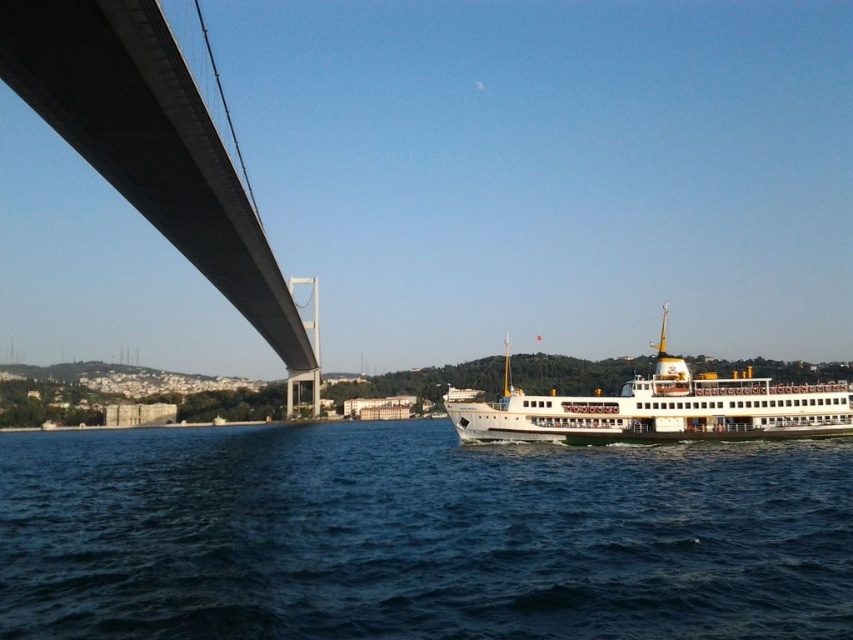
Based on the photo, can you confirm if dark blue water at lower center is smaller than white glossy ferry at center?

Correct, dark blue water at lower center occupies less space than white glossy ferry at center.

Does dark blue water at lower center lie in front of white glossy ferry at center?

Yes, dark blue water at lower center is in front of white glossy ferry at center.

You are a GUI agent. You are given a task and a screenshot of the screen. Output one action in this format:
    pyautogui.click(x=<x>, y=<y>)
    Task: Click on the dark blue water at lower center
    This screenshot has height=640, width=853.
    Given the screenshot: What is the action you would take?
    pyautogui.click(x=418, y=538)

You are a GUI agent. You are given a task and a screenshot of the screen. Output one action in this format:
    pyautogui.click(x=<x>, y=<y>)
    Task: Click on the dark blue water at lower center
    
    Given the screenshot: What is the action you would take?
    pyautogui.click(x=418, y=538)

Does gray concrete suspension bridge at upper left have a lesser height compared to white glossy ferry at center?

In fact, gray concrete suspension bridge at upper left may be taller than white glossy ferry at center.

Describe the element at coordinates (154, 147) in the screenshot. Image resolution: width=853 pixels, height=640 pixels. I see `gray concrete suspension bridge at upper left` at that location.

Does point (212, 125) come farther from viewer compared to point (795, 403)?

No, it is not.

Locate an element on the screen. This screenshot has width=853, height=640. gray concrete suspension bridge at upper left is located at coordinates (154, 147).

Can you confirm if dark blue water at lower center is bigger than gray concrete suspension bridge at upper left?

No.

Is dark blue water at lower center positioned in front of gray concrete suspension bridge at upper left?

Yes.

Who is more forward, (735, 611) or (97, 81)?

Positioned in front is point (735, 611).

This screenshot has width=853, height=640. I want to click on dark blue water at lower center, so click(418, 538).